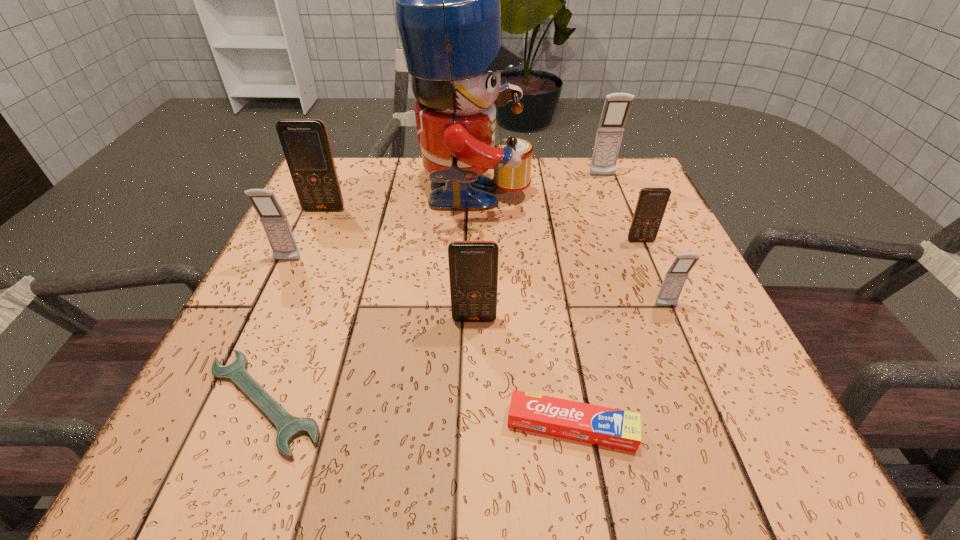
This screenshot has height=540, width=960. Find the location of `vacant region located on the screen of the second smallest orange cellular telephone`. vacant region located on the screen of the second smallest orange cellular telephone is located at coordinates (473, 432).

Locate an element on the screen. This screenshot has height=540, width=960. free space located on the screen of the fourth nearest cellular telephone is located at coordinates click(684, 344).

Image resolution: width=960 pixels, height=540 pixels. Find the location of `vacant space situated on the front-facing side of the nearest gray cellular telephone`. vacant space situated on the front-facing side of the nearest gray cellular telephone is located at coordinates (730, 455).

Locate an element on the screen. The height and width of the screenshot is (540, 960). free space located on the back of the toothpaste is located at coordinates (562, 369).

Where is `free space located on the back of the shortest object`? The width and height of the screenshot is (960, 540). free space located on the back of the shortest object is located at coordinates (294, 327).

Identify the location of nutcracker located in the far edge section of the desktop. Image resolution: width=960 pixels, height=540 pixels. (447, 0).

I want to click on toothpaste that is at the near edge, so click(614, 428).

Where is `wrench present at the near edge`? wrench present at the near edge is located at coordinates (289, 427).

You are a GUI agent. You are given a task and a screenshot of the screen. Output one action in this format:
    pyautogui.click(x=<x>, y=<y>)
    Task: Click on the wrench situated at the left edge
    The height and width of the screenshot is (540, 960).
    Given the screenshot: What is the action you would take?
    pyautogui.click(x=289, y=427)

Identify the location of object that is at the far left corner. (305, 143).